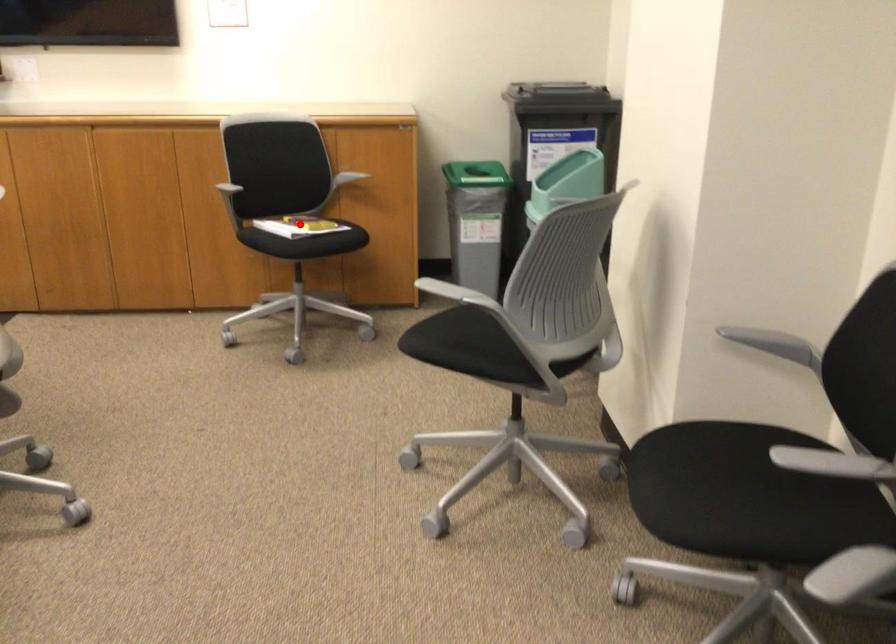
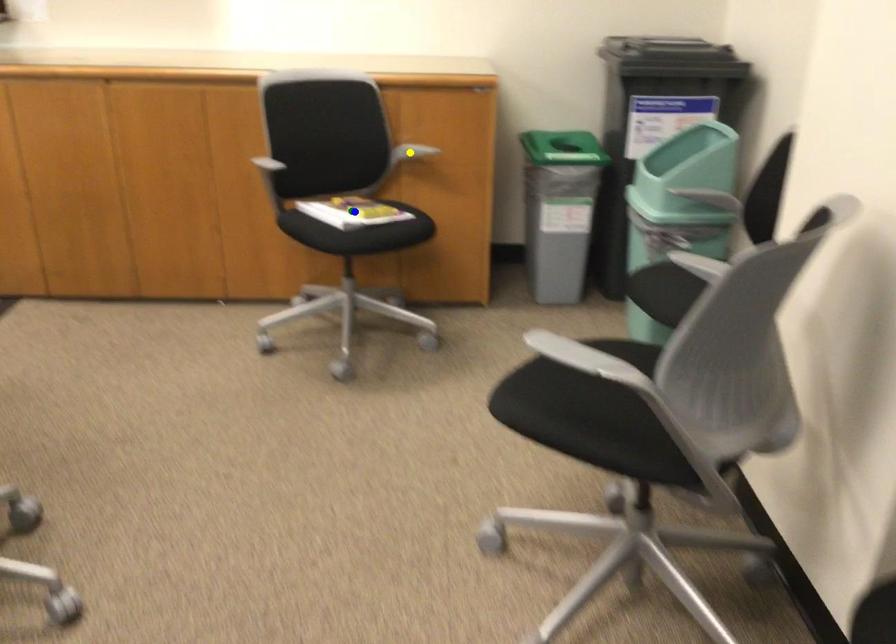
Question: I am providing you with two images of the same scene from different viewpoints. A red point is marked on the first image. You are given multiple points on the second image. Which point in image 2 represents the same 3d spot as the red point in image 1?

Choices:
 (A) green point
 (B) yellow point
 (C) blue point

Answer: (A)